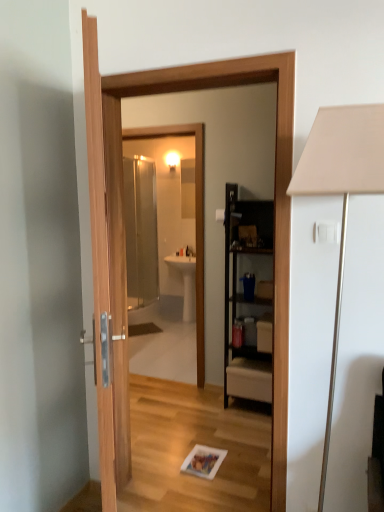
Question: Is point (337, 279) positioned closer to the camera than point (203, 282)?

Choices:
 (A) closer
 (B) farther

Answer: (A)

Question: Which is correct: white matte table lamp at right is inside transparent glass mirror at center, or outside of it?

Choices:
 (A) inside
 (B) outside

Answer: (B)

Question: Based on their relative distances, which object is farther from the black wood cabinet at center?

Choices:
 (A) white glossy sink at center
 (B) wooden door at center
 (C) white matte table lamp at right
 (D) transparent glass mirror at center

Answer: (C)

Question: Considering the real-world distances, which object is closest to the wooden door at center?

Choices:
 (A) black wood cabinet at center
 (B) white glossy sink at center
 (C) white matte table lamp at right
 (D) transparent glass mirror at center

Answer: (C)